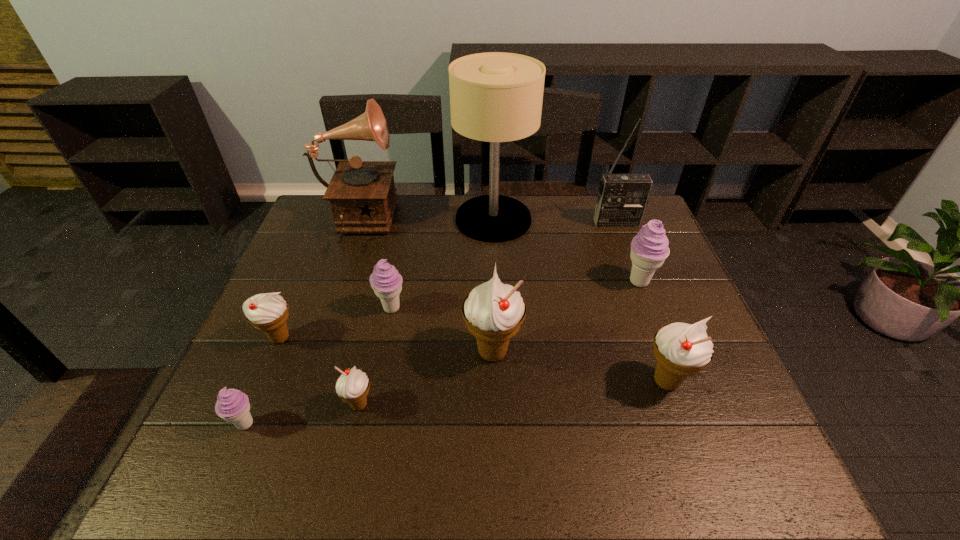
Locate an element on the screen. The height and width of the screenshot is (540, 960). free point located on the right of the second biggest white icecream is located at coordinates (714, 381).

Image resolution: width=960 pixels, height=540 pixels. Find the location of `vacant space situated 0.080m on the front of the leftmost white icecream`. vacant space situated 0.080m on the front of the leftmost white icecream is located at coordinates (261, 382).

This screenshot has width=960, height=540. I want to click on free location located on the back of the fifth farthest object, so click(409, 221).

Where is `blank area located 0.300m on the right of the second white icecream from left to right`? The height and width of the screenshot is (540, 960). blank area located 0.300m on the right of the second white icecream from left to right is located at coordinates 516,405.

Image resolution: width=960 pixels, height=540 pixels. I want to click on free space located 0.220m on the back of the leftmost purple icecream, so click(285, 332).

The image size is (960, 540). Find the location of `table lamp present at the far edge`. table lamp present at the far edge is located at coordinates (495, 97).

The image size is (960, 540). What are the coordinates of `record player that is at the far edge` in the screenshot? It's located at (362, 194).

I want to click on radio receiver at the far edge, so click(x=622, y=199).

Where is `record player positioned at the left edge`? Image resolution: width=960 pixels, height=540 pixels. record player positioned at the left edge is located at coordinates (362, 194).

The width and height of the screenshot is (960, 540). I want to click on radio receiver at the right edge, so click(622, 199).